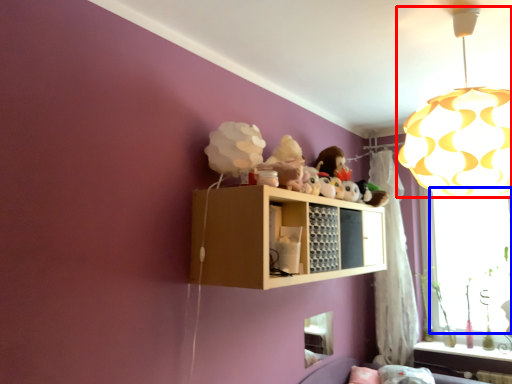
Question: Which point is closer to the camera, lamp (highlighted by a red box) or window screen (highlighted by a blue box)?

Choices:
 (A) lamp
 (B) window screen

Answer: (A)